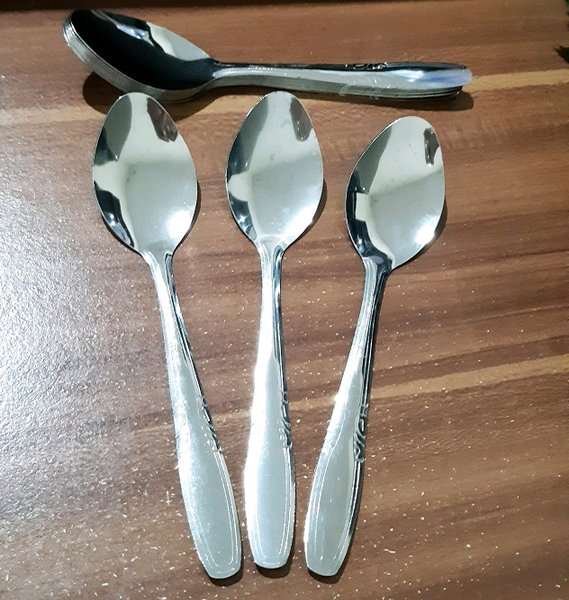
Identify the location of spoon. (138, 187), (155, 57), (107, 69), (101, 72), (272, 164), (395, 168).